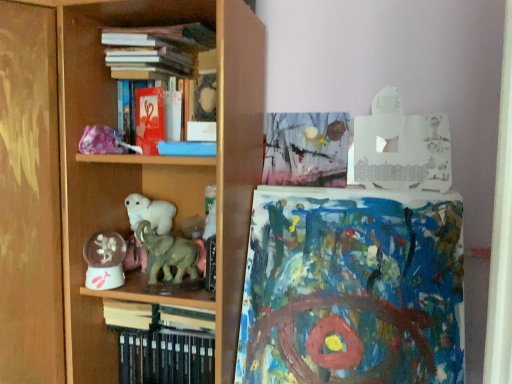
Locate an element on the screen. The image size is (512, 384). blue textured paper at center is located at coordinates (353, 288).

I want to click on translucent plastic snow globe at lower left, so click(105, 260).

Locate an element on the screen. watercolor paper painting at upper center, marked as the third book in a bottom-to-top arrangement is located at coordinates (306, 149).

From a real-world perspective, is hardcover book at center, which is the second book in bottom-to-top order, below hardcover books at lower left, arranged as the 4th book when viewed from the top?

No, from a real-world perspective, hardcover book at center, which is the second book in bottom-to-top order, is not beneath hardcover books at lower left, arranged as the 4th book when viewed from the top.

Is hardcover book at center, which is the second book in bottom-to-top order, with hardcover books at lower left, arranged as the 4th book when viewed from the top?

Indeed, hardcover book at center, which is the second book in bottom-to-top order, and hardcover books at lower left, arranged as the 4th book when viewed from the top, are beside each other and touching.

From the image's perspective, is hardcover book at center, which is the 3th book in top-to-bottom order, below hardcover books at lower left, arranged as the 4th book when viewed from the top?

Incorrect, from the image's perspective, hardcover book at center, which is the 3th book in top-to-bottom order, is higher than hardcover books at lower left, arranged as the 4th book when viewed from the top.

Between hardcover book at center, which is the 3th book in top-to-bottom order, and hardcover books at lower left, the 1th book positioned from the bottom, which one has larger width?

hardcover books at lower left, the 1th book positioned from the bottom.

Is point (303, 342) less distant than point (168, 311)?

Yes, it is in front of point (168, 311).

Considering their positions, is blue textured paper at center located in front of or behind hardcover book at center, which is the 3th book in top-to-bottom order?

In the image, blue textured paper at center appears in front of hardcover book at center, which is the 3th book in top-to-bottom order.

From a real-world perspective, is blue textured paper at center above or below hardcover book at center, which is the second book in bottom-to-top order?

blue textured paper at center is above hardcover book at center, which is the second book in bottom-to-top order.

Is blue textured paper at center situated inside hardcover book at center, which is the second book in bottom-to-top order, or outside?

blue textured paper at center lies outside hardcover book at center, which is the second book in bottom-to-top order.

How many degrees apart are the facing directions of hardcover book at center, which is the 3th book in top-to-bottom order, and translucent plastic snow globe at lower left?

1.52 degrees separate the facing orientations of hardcover book at center, which is the 3th book in top-to-bottom order, and translucent plastic snow globe at lower left.

Is hardcover book at center, which is the second book in bottom-to-top order, spatially inside translucent plastic snow globe at lower left, or outside of it?

hardcover book at center, which is the second book in bottom-to-top order, is not enclosed by translucent plastic snow globe at lower left.

Consider the image. Could you tell me if hardcover book at center, which is the second book in bottom-to-top order, is turned towards translucent plastic snow globe at lower left?

No.

In terms of width, does hardcover book at center, which is the 3th book in top-to-bottom order, look wider or thinner when compared to translucent plastic snow globe at lower left?

hardcover book at center, which is the 3th book in top-to-bottom order, is wider than translucent plastic snow globe at lower left.

Which is behind, hardcover book at center, which is the 3th book in top-to-bottom order, or green matte elephant at center?

hardcover book at center, which is the 3th book in top-to-bottom order.

Is hardcover book at center, which is the second book in bottom-to-top order, spatially inside green matte elephant at center, or outside of it?

hardcover book at center, which is the second book in bottom-to-top order, is located beyond the bounds of green matte elephant at center.

In the scene shown: Which of these two, hardcover book at center, which is the 3th book in top-to-bottom order, or green matte elephant at center, is smaller?

hardcover book at center, which is the 3th book in top-to-bottom order, is smaller.

Which is less distant, (182, 315) or (158, 235)?

The point (182, 315) is in front.

Image resolution: width=512 pixels, height=384 pixels. I want to click on the 1st book below the wooden shelf at center (from a real-world perspective), so click(x=187, y=318).

Which is closer to the camera, (46, 308) or (177, 312)?

Point (46, 308).

Can you confirm if wooden shelf at center is thinner than hardcover book at center, which is the second book in bottom-to-top order?

No, wooden shelf at center is not thinner than hardcover book at center, which is the second book in bottom-to-top order.

From the image's perspective, is wooden shelf at center located beneath hardcover book at center, which is the 3th book in top-to-bottom order?

No, from the image's perspective, wooden shelf at center is not below hardcover book at center, which is the 3th book in top-to-bottom order.

Is translucent plastic snow globe at lower left in front of or behind green matte elephant at center in the image?

translucent plastic snow globe at lower left is positioned farther from the viewer than green matte elephant at center.

Which object is positioned more to the right, translucent plastic snow globe at lower left or green matte elephant at center?

Positioned to the right is green matte elephant at center.

Between translucent plastic snow globe at lower left and green matte elephant at center, which one has larger size?

green matte elephant at center.

From the picture: Who is more distant, translucent plastic snow globe at lower left or hardcover books at upper center, acting as the 1th book starting from the top?

translucent plastic snow globe at lower left is further away from the camera.

From a real-world perspective, is translucent plastic snow globe at lower left under hardcover books at upper center, the 4th book ordered from the bottom?

Yes, from a real-world perspective, translucent plastic snow globe at lower left is below hardcover books at upper center, the 4th book ordered from the bottom.

Considering the relative sizes of translucent plastic snow globe at lower left and hardcover books at upper center, acting as the 1th book starting from the top, in the image provided, is translucent plastic snow globe at lower left wider than hardcover books at upper center, acting as the 1th book starting from the top,?

No.

Can you confirm if translucent plastic snow globe at lower left is positioned to the right of hardcover books at upper center, the 4th book ordered from the bottom?

No, translucent plastic snow globe at lower left is not to the right of hardcover books at upper center, the 4th book ordered from the bottom.

Find the location of `the 1st book behind the hardcover books at lower left, arranged as the 4th book when viewed from the top`. the 1st book behind the hardcover books at lower left, arranged as the 4th book when viewed from the top is located at coordinates (187, 318).

From a real-world perspective, starting from the blue textured paper at center, which book is the 1st one below it? Please provide its 2D coordinates.

[(187, 318)]

From the image, which object appears to be nearer to blue textured paper at center, hardcover books at upper center, the 4th book ordered from the bottom, or hardcover books at lower left, arranged as the 4th book when viewed from the top?

hardcover books at lower left, arranged as the 4th book when viewed from the top, is closer to blue textured paper at center.

Looking at the image, which one is located closer to hardcover books at lower left, the 1th book positioned from the bottom, hardcover book at center, which is the 3th book in top-to-bottom order, or watercolor paper painting at upper center, marked as the third book in a bottom-to-top arrangement?

hardcover book at center, which is the 3th book in top-to-bottom order, lies closer to hardcover books at lower left, the 1th book positioned from the bottom, than the other object.

Looking at the image, which one is located further to green matte elephant at center, hardcover book at center, which is the second book in bottom-to-top order, or watercolor paper painting at upper center, which is counted as the second book, starting from the top?

watercolor paper painting at upper center, which is counted as the second book, starting from the top.

When comparing their distances from green matte elephant at center, does hardcover books at lower left, arranged as the 4th book when viewed from the top, or blue textured paper at center seem further?

blue textured paper at center lies further to green matte elephant at center than the other object.

Estimate the real-world distances between objects in this image. Which object is further from blue textured paper at center, translucent plastic snow globe at lower left or hardcover books at lower left, arranged as the 4th book when viewed from the top?

translucent plastic snow globe at lower left is further to blue textured paper at center.

Estimate the real-world distances between objects in this image. Which object is further from wooden shelf at center, hardcover book at center, which is the second book in bottom-to-top order, or blue textured paper at center?

Among the two, hardcover book at center, which is the second book in bottom-to-top order, is located further to wooden shelf at center.

Looking at the image, which one is located further to wooden shelf at center, blue textured paper at center or hardcover books at lower left, the 1th book positioned from the bottom?

blue textured paper at center is positioned further to the anchor wooden shelf at center.

Which object lies further to the anchor point hardcover book at center, which is the second book in bottom-to-top order, hardcover books at upper center, acting as the 1th book starting from the top, or wooden shelf at center?

hardcover books at upper center, acting as the 1th book starting from the top.

The width and height of the screenshot is (512, 384). Find the location of `animal that lies between hardcover books at upper center, the 4th book ordered from the bottom, and hardcover book at center, which is the second book in bottom-to-top order, from top to bottom`. animal that lies between hardcover books at upper center, the 4th book ordered from the bottom, and hardcover book at center, which is the second book in bottom-to-top order, from top to bottom is located at coordinates (168, 254).

At what (x,y) coordinates should I click in order to perform the action: click on animal between hardcover books at lower left, arranged as the 4th book when viewed from the top, and blue textured paper at center. Please return your answer as a coordinate pair (x, y). Looking at the image, I should click on (168, 254).

At what (x,y) coordinates should I click in order to perform the action: click on toy between hardcover books at upper center, the 4th book ordered from the bottom, and blue textured paper at center in the up-down direction. Please return your answer as a coordinate pair (x, y). The width and height of the screenshot is (512, 384). Looking at the image, I should click on (105, 260).

Where is `animal between hardcover books at upper center, the 4th book ordered from the bottom, and translucent plastic snow globe at lower left from top to bottom`? The width and height of the screenshot is (512, 384). animal between hardcover books at upper center, the 4th book ordered from the bottom, and translucent plastic snow globe at lower left from top to bottom is located at coordinates (168, 254).